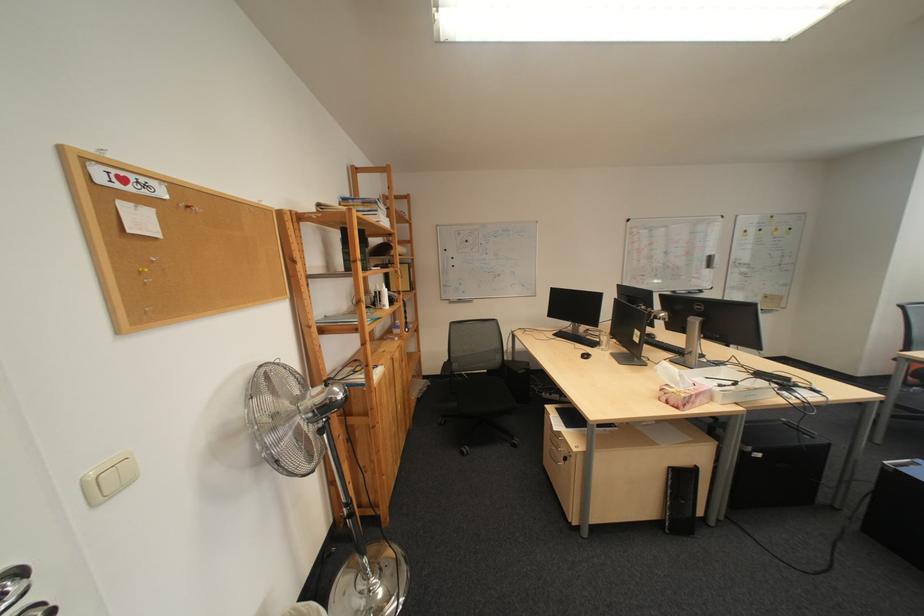
At what (x,y) coordinates should I click in order to perform the action: click on computer power button. Please return your answer as a coordinate pair (x, y). This screenshot has height=616, width=924. Looking at the image, I should click on (585, 355).